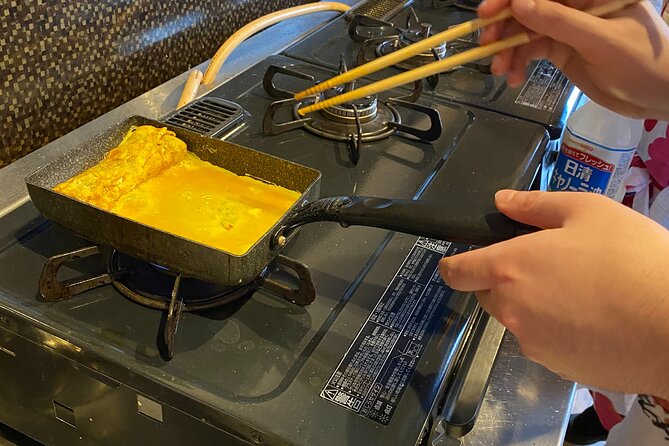
Find the location of `black and white label on stove`. black and white label on stove is located at coordinates (401, 301), (536, 82).